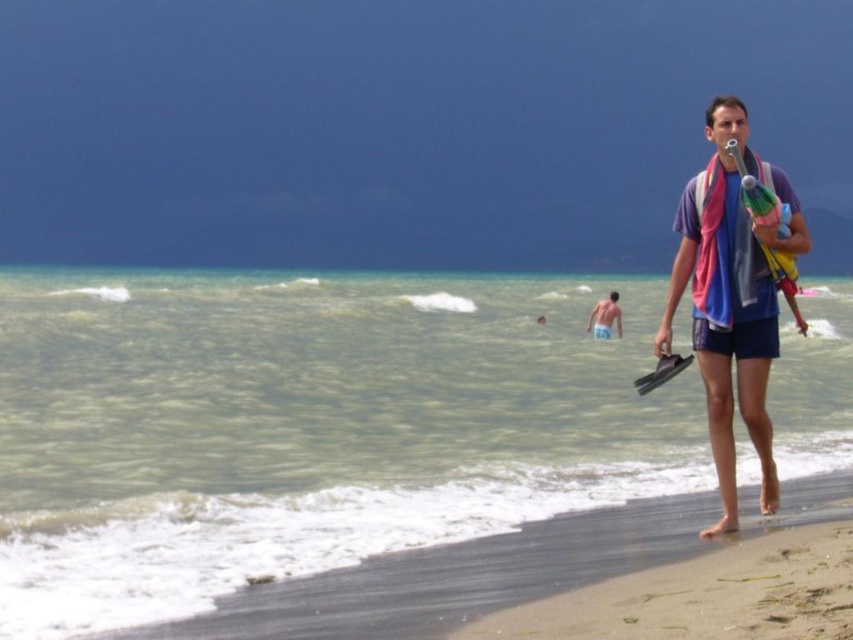
You are a photographer on the beach and want to capture a photo that includes both the clear water at beach front and the brown sandy beach at lower right. Which object should be placed higher in the frame to ensure both are visible?

The clear water at beach front has a greater height compared to the brown sandy beach at lower right, so to ensure both are visible in the photo, the clear water at beach front should be placed higher in the frame.